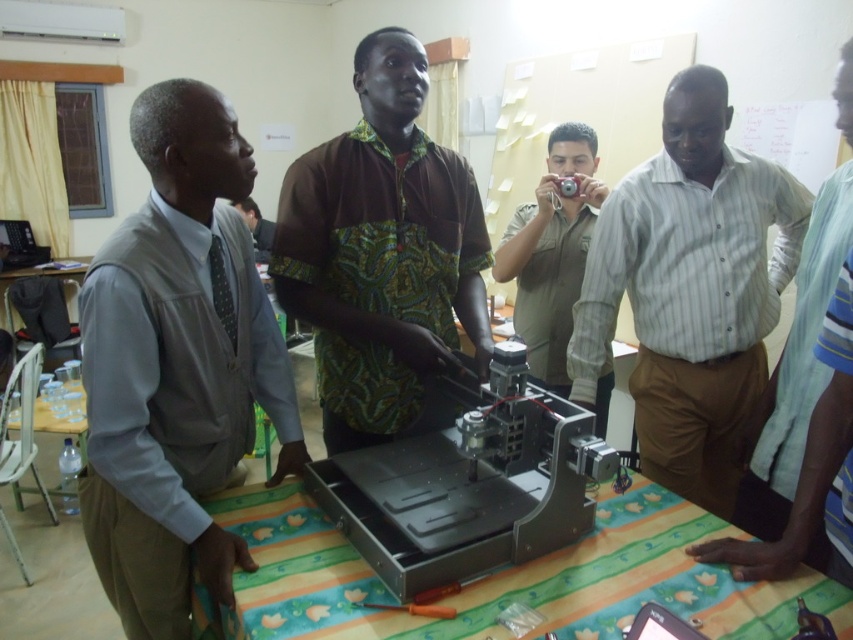
Between point (136, 538) and point (689, 200), which one is positioned behind?

Point (689, 200)

Does light brown fabric vest at left have a lesser height compared to striped cotton shirt at center?

Correct, light brown fabric vest at left is not as tall as striped cotton shirt at center.

Is point (163, 308) farther from camera compared to point (596, 237)?

No.

Locate an element on the screen. This screenshot has height=640, width=853. light brown fabric vest at left is located at coordinates (177, 365).

Does point (229, 221) come closer to viewer compared to point (715, 611)?

No.

Measure the distance between light brown fabric vest at left and metallic silver table at center.

They are 33.86 centimeters apart.

What are the coordinates of `light brown fabric vest at left` in the screenshot? It's located at (177, 365).

Does metallic silver table at center appear under khaki uniform at center?

Yes.

Is metallic silver table at center wider than khaki uniform at center?

Yes, metallic silver table at center is wider than khaki uniform at center.

This screenshot has height=640, width=853. Identify the location of metallic silver table at center. (500, 572).